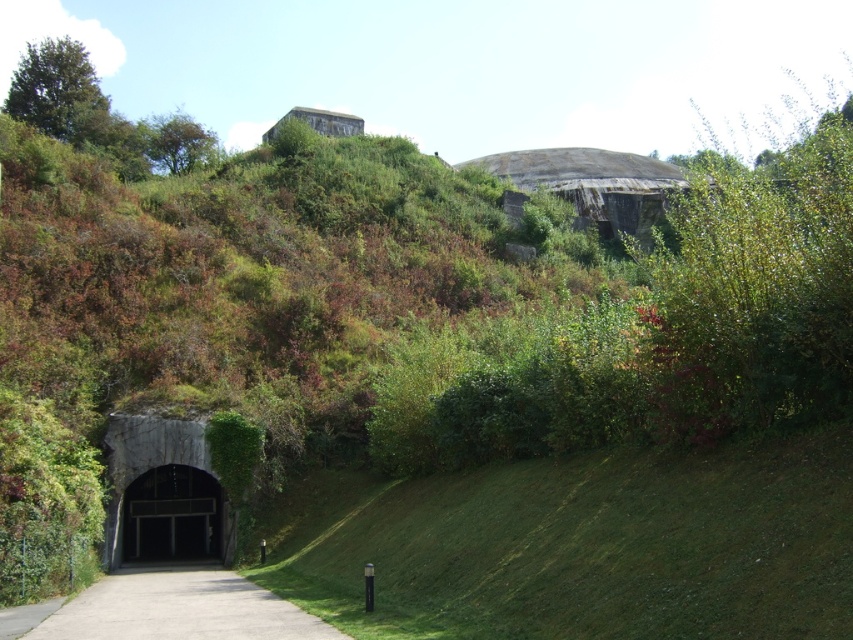
You are a hiker who just arrived at the scene. You need to decide whether to take the gray concrete bunker at lower left or the black concrete tunnel at lower left first. Based on their positions, which one should you approach first if you want to reach the tunnel entrance first?

The gray concrete bunker at lower left is to the right of black concrete tunnel at lower left. Since the bunker is to the right of the tunnel, if you want to reach the tunnel entrance first, you should approach the black concrete tunnel at lower left first before the bunker.

You are a hiker who has come across this landscape and wants to take shelter from an unexpected rainstorm. You notice the gray concrete bunker at lower left and the black concrete tunnel at lower left. Which structure would provide more interior space for you to wait out the storm?

The gray concrete bunker at lower left is bigger than the black concrete tunnel at lower left, so it would provide more interior space for shelter.